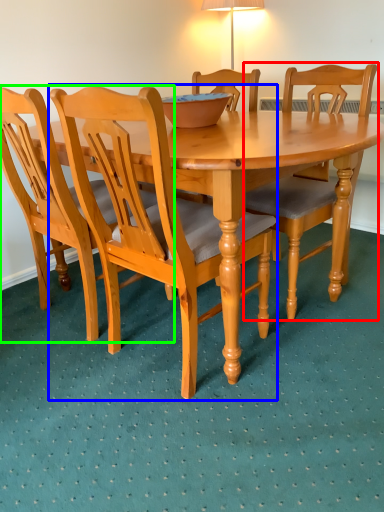
Question: Estimate the real-world distances between objects in this image. Which object is farther from chair (highlighted by a red box), chair (highlighted by a blue box) or chair (highlighted by a green box)?

Choices:
 (A) chair
 (B) chair

Answer: (B)